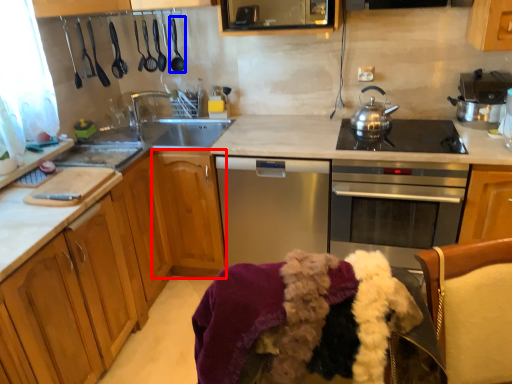
Question: Which object is further to the camera taking this photo, cabinetry (highlighted by a red box) or appliance (highlighted by a blue box)?

Choices:
 (A) cabinetry
 (B) appliance

Answer: (B)